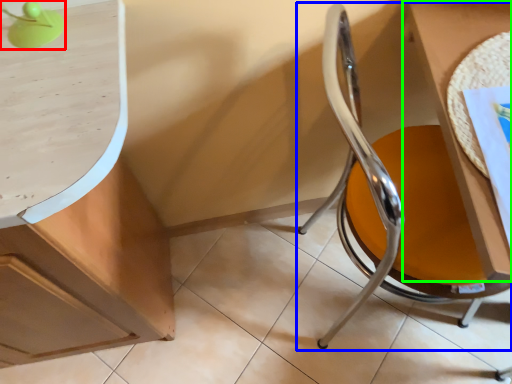
Question: Based on their relative distances, which object is nearer to table lamp (highlighted by a red box)? Choose from chair (highlighted by a blue box) and table (highlighted by a green box).

Choices:
 (A) chair
 (B) table

Answer: (A)